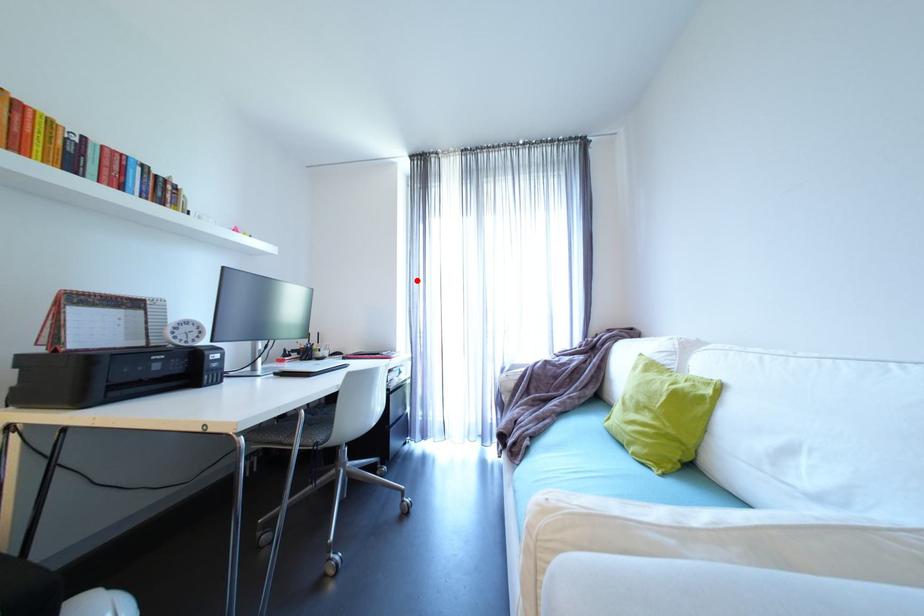
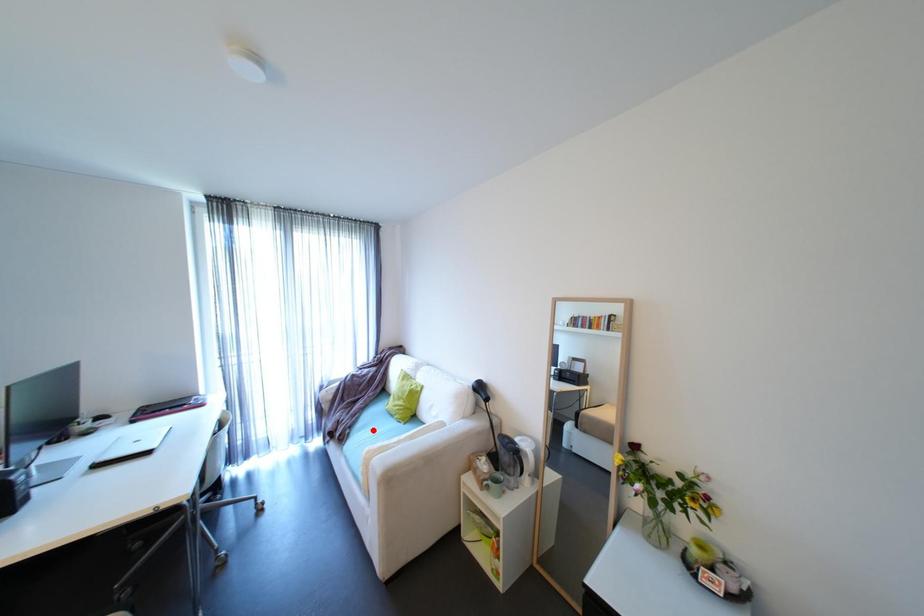
I am providing you with two images of the same scene from different viewpoints. A red point is marked on the first image and another point is marked on the second image. Does the point marked in image1 correspond to the same location as the one in image2?

No